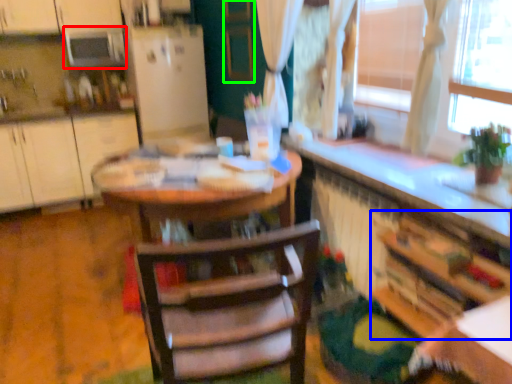
Question: Which object is positioned farthest from appliance (highlighted by a red box)? Select from cabinetry (highlighted by a blue box) and screen door (highlighted by a green box).

Choices:
 (A) cabinetry
 (B) screen door

Answer: (A)